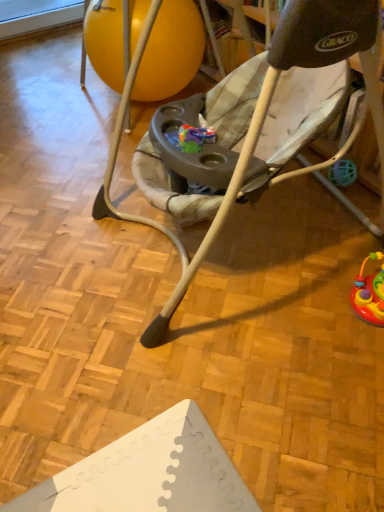
Question: Should I look upward or downward to see rubberized yellow ball at center?

Choices:
 (A) up
 (B) down

Answer: (A)

Question: Does rubberized yellow ball at center have a larger size compared to gray fabric baby swing at center?

Choices:
 (A) no
 (B) yes

Answer: (A)

Question: Are rubberized yellow ball at center and gray fabric baby swing at center beside each other?

Choices:
 (A) no
 (B) yes

Answer: (A)

Question: Is rubberized yellow ball at center positioned far away from gray fabric baby swing at center?

Choices:
 (A) yes
 (B) no

Answer: (A)

Question: From a real-world perspective, is rubberized yellow ball at center on top of gray fabric baby swing at center?

Choices:
 (A) no
 (B) yes

Answer: (A)

Question: Is rubberized yellow ball at center to the right of gray fabric baby swing at center from the viewer's perspective?

Choices:
 (A) no
 (B) yes

Answer: (A)

Question: Is rubberized yellow ball at center to the left of gray fabric baby swing at center from the viewer's perspective?

Choices:
 (A) no
 (B) yes

Answer: (B)

Question: Are gray fabric baby swing at center and rubberized yellow ball at center beside each other?

Choices:
 (A) no
 (B) yes

Answer: (A)

Question: Is gray fabric baby swing at center shorter than rubberized yellow ball at center?

Choices:
 (A) yes
 (B) no

Answer: (B)

Question: From a real-world perspective, does gray fabric baby swing at center sit lower than rubberized yellow ball at center?

Choices:
 (A) no
 (B) yes

Answer: (A)

Question: Considering the relative positions of gray fabric baby swing at center and rubberized yellow ball at center in the image provided, is gray fabric baby swing at center to the right of rubberized yellow ball at center from the viewer's perspective?

Choices:
 (A) yes
 (B) no

Answer: (A)

Question: Does gray fabric baby swing at center have a larger size compared to rubberized yellow ball at center?

Choices:
 (A) yes
 (B) no

Answer: (A)

Question: Is gray fabric baby swing at center closer to camera compared to rubberized yellow ball at center?

Choices:
 (A) no
 (B) yes

Answer: (B)

Question: From the image's perspective, relative to rubberized yellow ball at center, is gray fabric baby swing at center above or below?

Choices:
 (A) above
 (B) below

Answer: (B)